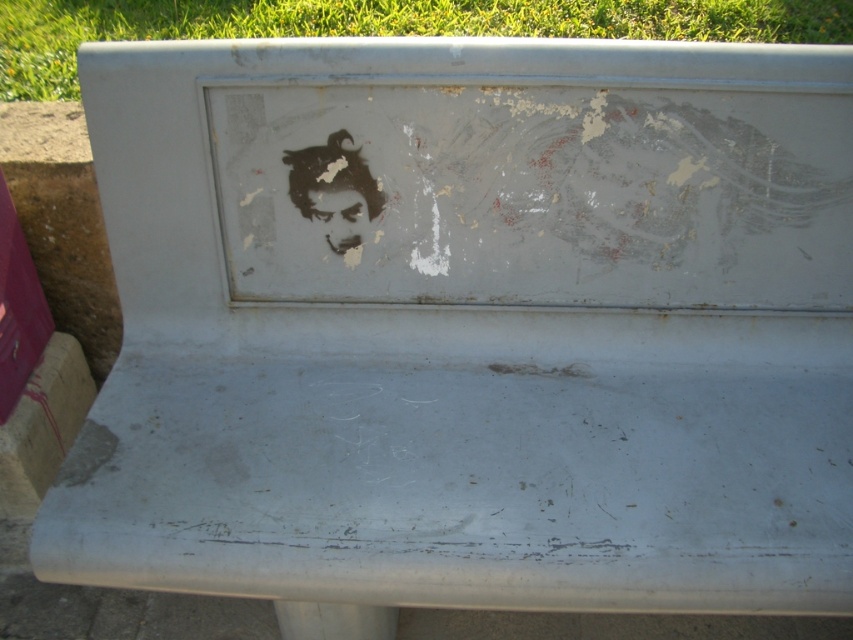
What is the coordinate of the green grass at top?

The green grass at top is located at coordinate point (381, 24).

You are a painter who wants to add a new decorative element to the scene. You have a 1 meter wide red ribbon. If you want to place it horizontally between the green grass at top and the matte black face at center, will it fit without overlapping either of them?

The green grass at top is wider than the matte black face at center. Since the ribbon is 1 meter wide, it depends on the available space between them. However, the description does not provide the distance between the two objects, so we cannot determine if the ribbon will fit without overlapping.

Looking at this image, you are standing in front of the weathered concrete bench and notice two points marked on its backrest. The first point is at coordinate (612,1) and the second at (325,234). Which of these points is closer to you?

Point (612,1) is further to the camera than point (325,234), so the point at (325,234) is closer to you.